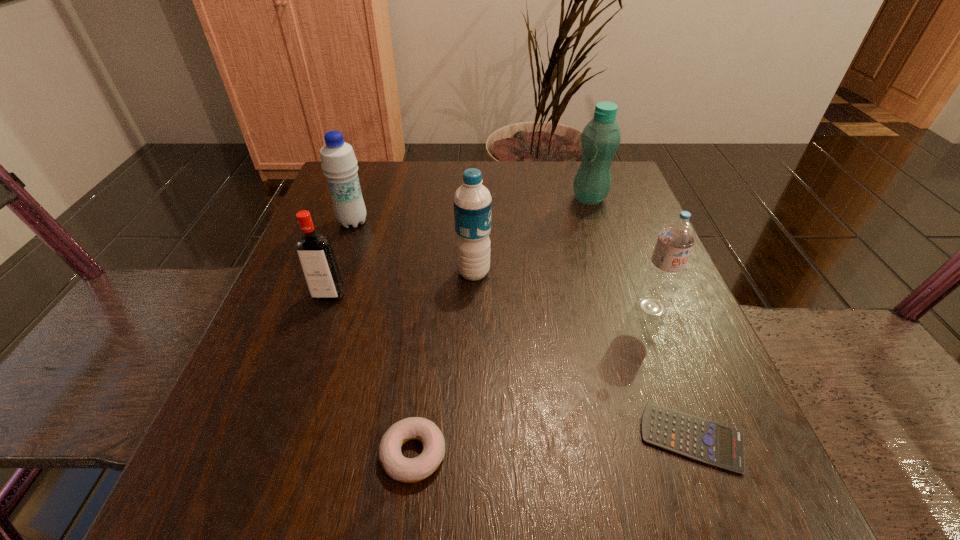
Find the location of `the farthest water bottle`. the farthest water bottle is located at coordinates (600, 139).

In order to click on the fifth nearest object in this screenshot , I will do `click(472, 201)`.

You are a GUI agent. You are given a task and a screenshot of the screen. Output one action in this format:
    pyautogui.click(x=<x>, y=<y>)
    Task: Click on the third farthest water bottle
    Image resolution: width=960 pixels, height=540 pixels.
    Given the screenshot: What is the action you would take?
    point(472,201)

The width and height of the screenshot is (960, 540). I want to click on the second farthest object, so click(x=338, y=161).

The height and width of the screenshot is (540, 960). In order to click on the third nearest water bottle in this screenshot , I will do (338, 161).

What are the coordinates of `the nearest water bottle` in the screenshot? It's located at (677, 236).

Identify the location of vodka. The width and height of the screenshot is (960, 540). 316,257.

Where is `the second shortest object`? the second shortest object is located at coordinates (408, 470).

In order to click on doughnut in this screenshot , I will do `click(408, 470)`.

You are a GUI agent. You are given a task and a screenshot of the screen. Output one action in this format:
    pyautogui.click(x=<x>, y=<y>)
    Task: Click on the shortest object
    
    Given the screenshot: What is the action you would take?
    pyautogui.click(x=697, y=438)